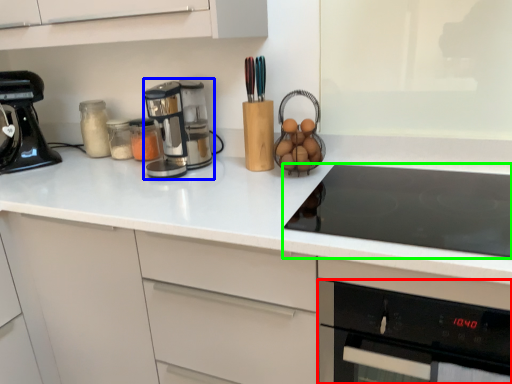
Question: Considering the real-world distances, which object is farthest from oven (highlighted by a red box)? kitchen appliance (highlighted by a blue box) or gas stove (highlighted by a green box)?

Choices:
 (A) kitchen appliance
 (B) gas stove

Answer: (A)